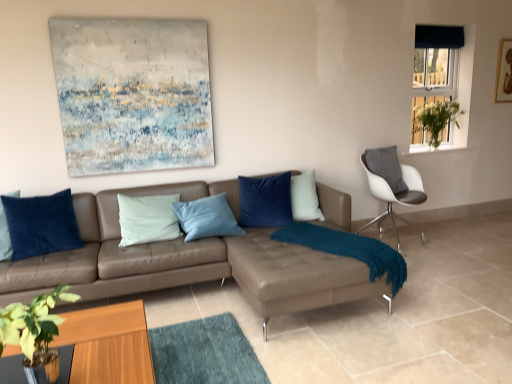
What do you see at coordinates (189, 261) in the screenshot? The height and width of the screenshot is (384, 512). I see `brown leather couch at center` at bounding box center [189, 261].

What do you see at coordinates (349, 250) in the screenshot?
I see `teal fuzzy blanket at lower right` at bounding box center [349, 250].

Measure the distance between white glossy chair at right and camera.

They are 3.77 meters apart.

Where is `white glossy chair at right`? white glossy chair at right is located at coordinates (392, 190).

I want to click on blue fabric curtain at upper right, so click(435, 79).

Identify the location of velvet blue pillow at center, placed as the 2th pillow when sorted from left to right. The width and height of the screenshot is (512, 384). (265, 201).

Does blue fabric curtain at upper right come behind wooden picture frame at upper right?

No.

Between point (412, 136) and point (509, 64), which one is positioned in front?

The point (412, 136) is closer.

Is blue fabric curtain at upper right facing towards wooden picture frame at upper right?

No, blue fabric curtain at upper right does not turn towards wooden picture frame at upper right.

From a real-world perspective, does blue fabric curtain at upper right stand above wooden picture frame at upper right?

No.

Is point (455, 73) closer to camera compared to point (424, 127)?

That is False.

Between blue fabric curtain at upper right and green leafy plant at upper right, which one has larger width?

Wider between the two is green leafy plant at upper right.

Who is more distant, blue fabric curtain at upper right or green leafy plant at upper right?

Positioned behind is blue fabric curtain at upper right.

Is green leafy plant at upper right surrounded by blue fabric curtain at upper right?

No, green leafy plant at upper right is not surrounded by blue fabric curtain at upper right.

Is point (454, 27) positioned in front of point (55, 336)?

No, it is not.

What's the angular difference between dark blue velvet curtain at upper right and wooden coffee table at lower left's facing directions?

They differ by 88.9 degrees in their facing directions.

Is dark blue velvet curtain at upper right further to camera compared to wooden coffee table at lower left?

Yes, the depth of dark blue velvet curtain at upper right is greater than that of wooden coffee table at lower left.

From a real-world perspective, which is physically above, wooden coffee table at lower left or green leafy plant at upper right?

green leafy plant at upper right.

Is wooden coffee table at lower left smaller than green leafy plant at upper right?

Incorrect, wooden coffee table at lower left is not smaller in size than green leafy plant at upper right.

Between point (125, 333) and point (412, 132), which one is positioned in front?

The point (125, 333) is more forward.

Is wooden coffee table at lower left oriented towards green leafy plant at upper right?

No, wooden coffee table at lower left is not facing towards green leafy plant at upper right.

Is velvet blue pillow at center, placed as the 2th pillow when sorted from left to right, aimed at wooden picture frame at upper right?

No, velvet blue pillow at center, placed as the 2th pillow when sorted from left to right, is not turned towards wooden picture frame at upper right.

Is wooden picture frame at upper right surrounded by velvet blue pillow at center, placed as the 2th pillow when sorted from left to right?

No, wooden picture frame at upper right is not surrounded by velvet blue pillow at center, placed as the 2th pillow when sorted from left to right.

Based on the photo, from a real-world perspective, which is physically above, velvet blue pillow at center, which is counted as the first pillow, starting from the back, or wooden picture frame at upper right?

wooden picture frame at upper right is physically above.

How far apart are velvet blue pillow at center, placed as the 2th pillow when sorted from left to right, and wooden picture frame at upper right?

The distance of velvet blue pillow at center, placed as the 2th pillow when sorted from left to right, from wooden picture frame at upper right is 3.21 meters.

Locate an element on the screen. Image resolution: width=512 pixels, height=384 pixels. chair that appears below the blue fabric curtain at upper right (from the image's perspective) is located at coordinates (392, 190).

Does blue fabric curtain at upper right lie in front of white glossy chair at right?

That is False.

Is blue fabric curtain at upper right with white glossy chair at right?

No, blue fabric curtain at upper right is not touching white glossy chair at right.

Which object is positioned more to the right, green leafy plant at lower left or brown leather couch at center?

brown leather couch at center.

Are green leafy plant at lower left and brown leather couch at center located far from each other?

That's right, there is a large distance between green leafy plant at lower left and brown leather couch at center.

From a real-world perspective, which object rests below the other?

In real-world perspective, brown leather couch at center is lower.

From the image's perspective, is green leafy plant at lower left on brown leather couch at center?

No, from the image's perspective, green leafy plant at lower left is not over brown leather couch at center.

I want to click on picture frame above the blue fabric curtain at upper right (from the image's perspective), so click(x=504, y=73).

Identify the location of plant in front of the blue fabric curtain at upper right. (435, 119).

From the image, which object appears to be farther from velvet blue pillow at center, which is the 1th pillow from right to left, green leafy plant at lower left or wooden picture frame at upper right?

wooden picture frame at upper right.

Which object lies nearer to the anchor point velvet blue pillow at center, which is counted as the first pillow, starting from the back, blue fabric curtain at upper right or white glossy chair at right?

The object closer to velvet blue pillow at center, which is counted as the first pillow, starting from the back, is white glossy chair at right.

Estimate the real-world distances between objects in this image. Which object is closer to blue fabric curtain at upper right, white glossy chair at right or brown leather footrest at center?

The object closer to blue fabric curtain at upper right is white glossy chair at right.

Which object lies further to the anchor point teal fuzzy blanket at lower right, wooden coffee table at lower left or velvet blue pillow at center, which is counted as the first pillow, starting from the back?

wooden coffee table at lower left.

Looking at the image, which one is located further to dark blue velvet curtain at upper right, brown leather couch at center or white glossy chair at right?

brown leather couch at center is positioned further to the anchor dark blue velvet curtain at upper right.

When comparing their distances from green leafy plant at lower left, does teal fuzzy blanket at lower right or blue fabric curtain at upper right seem further?

Among the two, blue fabric curtain at upper right is located further to green leafy plant at lower left.

Considering their positions, is green leafy plant at lower left positioned closer to velvet blue pillow at left, the first pillow viewed from the front, than brown leather couch at center?

Based on the image, brown leather couch at center appears to be nearer to velvet blue pillow at left, the first pillow viewed from the front.

Which object lies further to the anchor point velvet blue pillow at left, which is counted as the 2th pillow, starting from the back, teal fuzzy blanket at lower right or velvet blue pillow at center, which is counted as the first pillow, starting from the back?

teal fuzzy blanket at lower right is positioned further to the anchor velvet blue pillow at left, which is counted as the 2th pillow, starting from the back.

Find the location of a particular element. studio couch situated between wooden coffee table at lower left and white glossy chair at right from left to right is located at coordinates (189, 261).

Image resolution: width=512 pixels, height=384 pixels. Identify the location of pillow situated between wooden coffee table at lower left and wooden picture frame at upper right from left to right. coord(265,201).

Where is `chair between teal fuzzy blanket at lower right and green leafy plant at upper right from front to back`? Image resolution: width=512 pixels, height=384 pixels. chair between teal fuzzy blanket at lower right and green leafy plant at upper right from front to back is located at coordinates (392, 190).

Find the location of a particular element. Image resolution: width=512 pixels, height=384 pixels. curtain between brown leather footrest at center and wooden picture frame at upper right in the horizontal direction is located at coordinates (439, 36).